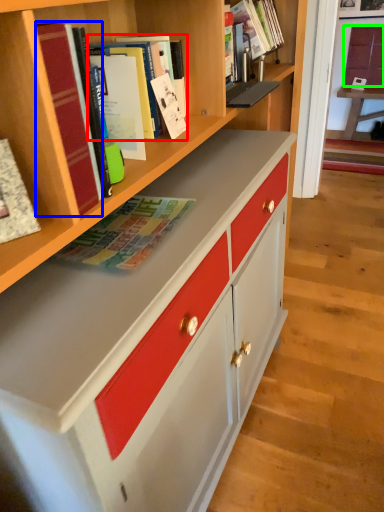
Question: Based on their relative distances, which object is farther from book (highlighted by a red box)? Choose from book (highlighted by a blue box) and cabinetry (highlighted by a green box).

Choices:
 (A) book
 (B) cabinetry

Answer: (B)